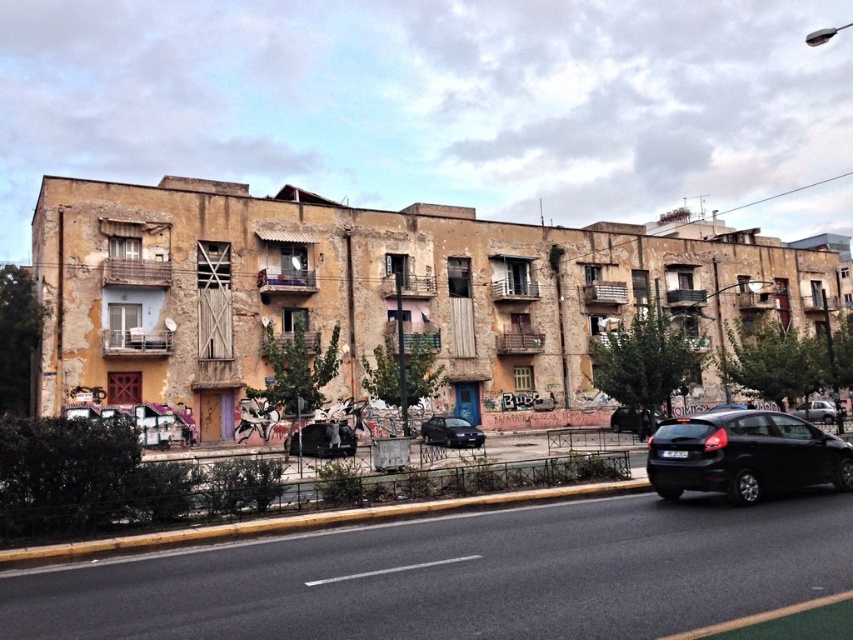
You are a pedestrian standing on the sidewalk next to the yellow curb. You need to cross the road to reach the buildings. Which car, the black matte hatchback at lower right or the metallic black car at center, is closer to you as you prepare to step onto the road?

The black matte hatchback at lower right is closer to you than the metallic black car at center, so you should be cautious of it first when stepping onto the road.

You are a delivery driver who needs to park your vehicle in this area. Your truck is 20 feet long. There is a black matte hatchback at lower right and a metallic black car at center. Can you safely park your truck between them without overlapping either vehicle?

The distance between the black matte hatchback at lower right and metallic black car at center is 67.50 feet. Since your truck is only 20 feet long, there is sufficient space between them to park safely without overlapping either vehicle.